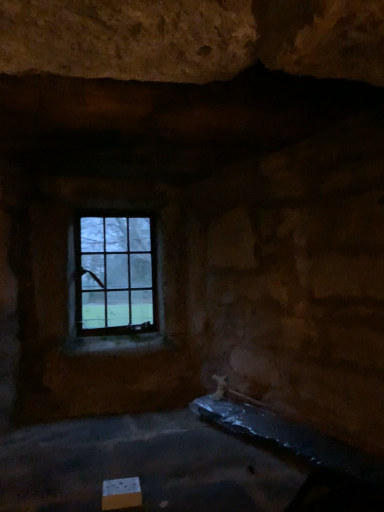
At what (x,y) coordinates should I click in order to perform the action: click on vacant space to the right of white cardboard box at lower left. Please return your answer as a coordinate pair (x, y). The width and height of the screenshot is (384, 512). Looking at the image, I should click on (185, 496).